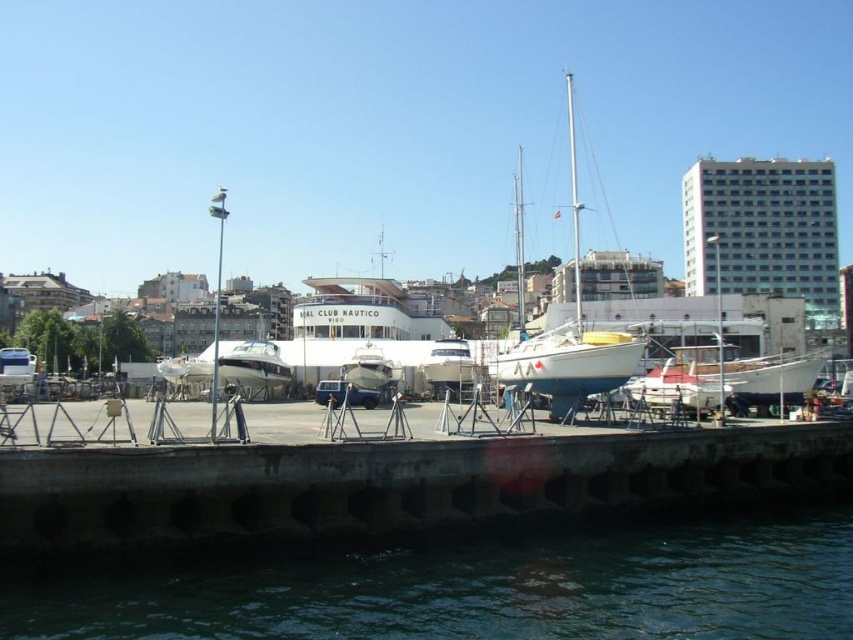
You are standing on the dock and want to know the position of the greenish water at lower center. According to the coordinates provided, where exactly is it located?

The greenish water at lower center is located at point [469,586].

Consider the image. You are a boat owner who wants to tie your boat to the dock. You have a 50 meter rope. The white matte sailboat at center is anchored 59.04 meters away from the dock. Can you safely secure your boat with the rope you have?

The white matte sailboat at center is anchored 59.04 meters away from the dock. Since your rope is only 50 meters long, it is not long enough to reach the boat. You will need a longer rope to safely secure your boat.

You are a delivery driver who needs to park your truck next to the matte black car at center without blocking the greenish water at lower center. Can you fit your truck there if your truck is 2 meters wide?

The greenish water at lower center is wider than the matte black car at center. Since the truck is 2 meters wide, it may be possible to park it next to the matte black car at center without blocking the greenish water at lower center, provided there is sufficient space on either side of the car.